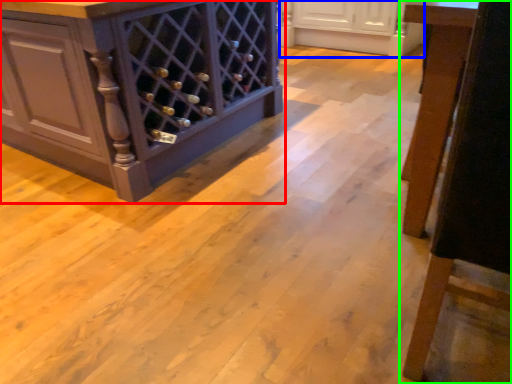
Question: Which is nearer to the cabinetry (highlighted by a red box)? cabinetry (highlighted by a blue box) or furniture (highlighted by a green box).

Choices:
 (A) cabinetry
 (B) furniture

Answer: (B)